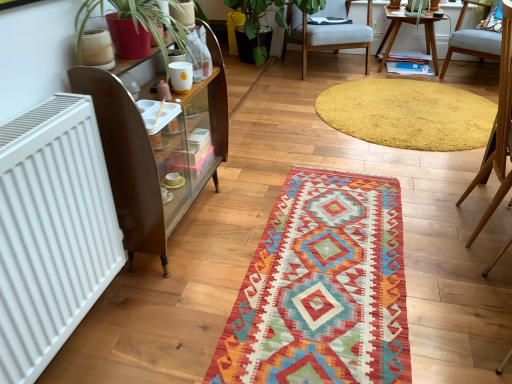
Question: Is light blue fabric chair at right, which is the 1th chair from front to back, bigger than multicolored woven mat at center, the first mat when ordered from front to back?

Choices:
 (A) no
 (B) yes

Answer: (B)

Question: Does light blue fabric chair at right, placed as the second chair when sorted from right to left, have a lesser width compared to multicolored woven mat at center, which is the 2th mat in back-to-front order?

Choices:
 (A) yes
 (B) no

Answer: (A)

Question: Is there a large distance between light blue fabric chair at right, the 2th chair from the left, and multicolored woven mat at center, which is the 2th mat in back-to-front order?

Choices:
 (A) yes
 (B) no

Answer: (B)

Question: Is light blue fabric chair at right, which is the third chair from back to front, positioned with its back to multicolored woven mat at center, the 2th mat positioned from the top?

Choices:
 (A) no
 (B) yes

Answer: (B)

Question: Does light blue fabric chair at right, which is the third chair from back to front, come behind multicolored woven mat at center, placed as the first mat when sorted from bottom to top?

Choices:
 (A) yes
 (B) no

Answer: (A)

Question: Considering the relative sizes of light blue fabric chair at right, which is the 1th chair from front to back, and multicolored woven mat at center, the 2th mat positioned from the top, in the image provided, is light blue fabric chair at right, which is the 1th chair from front to back, shorter than multicolored woven mat at center, the 2th mat positioned from the top,?

Choices:
 (A) yes
 (B) no

Answer: (B)

Question: Is there a large distance between yellow shaggy rug at upper center, which appears as the 1th mat when viewed from the top, and green matte plant at upper center?

Choices:
 (A) yes
 (B) no

Answer: (A)

Question: Can you confirm if yellow shaggy rug at upper center, which is the 2th mat from bottom to top, is taller than green matte plant at upper center?

Choices:
 (A) yes
 (B) no

Answer: (B)

Question: Is green matte plant at upper center located within yellow shaggy rug at upper center, which is the 2th mat from bottom to top?

Choices:
 (A) no
 (B) yes

Answer: (A)

Question: Can you confirm if yellow shaggy rug at upper center, the second mat when ordered from front to back, is shorter than green matte plant at upper center?

Choices:
 (A) no
 (B) yes

Answer: (B)

Question: Is yellow shaggy rug at upper center, the 1th mat viewed from the back, outside green matte plant at upper center?

Choices:
 (A) no
 (B) yes

Answer: (B)

Question: Is yellow shaggy rug at upper center, the 1th mat viewed from the back, oriented towards green matte plant at upper center?

Choices:
 (A) yes
 (B) no

Answer: (B)

Question: Is brown wooden shelf at left located outside light blue fabric chair at right, which is the third chair from back to front?

Choices:
 (A) yes
 (B) no

Answer: (A)